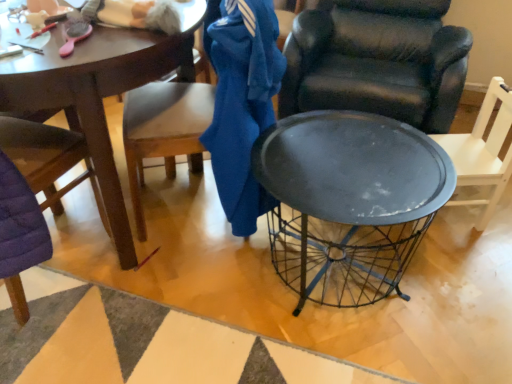
Question: Should I look upward or downward to see purple quilted chair at left, the 1th chair when ordered from left to right?

Choices:
 (A) down
 (B) up

Answer: (B)

Question: Can you confirm if matte black chair at right, positioned as the fourth chair in left-to-right order, is taller than matte black chair at center, the 2th chair when ordered from right to left?

Choices:
 (A) no
 (B) yes

Answer: (A)

Question: Can matte black chair at center, the third chair from the left, be found inside matte black chair at right, which ranks as the 1th chair in right-to-left order?

Choices:
 (A) no
 (B) yes

Answer: (A)

Question: Are matte black chair at right, which ranks as the 1th chair in right-to-left order, and matte black chair at center, the 2th chair when ordered from right to left, beside each other?

Choices:
 (A) yes
 (B) no

Answer: (B)

Question: Considering the relative positions of matte black chair at right, which ranks as the 1th chair in right-to-left order, and matte black chair at center, the 2th chair when ordered from right to left, in the image provided, is matte black chair at right, which ranks as the 1th chair in right-to-left order, to the right of matte black chair at center, the 2th chair when ordered from right to left, from the viewer's perspective?

Choices:
 (A) yes
 (B) no

Answer: (A)

Question: Is matte black chair at right, positioned as the fourth chair in left-to-right order, aimed at matte black chair at center, the third chair from the left?

Choices:
 (A) no
 (B) yes

Answer: (A)

Question: Can you confirm if matte black chair at right, positioned as the fourth chair in left-to-right order, is bigger than matte black chair at center, the 2th chair when ordered from right to left?

Choices:
 (A) no
 (B) yes

Answer: (A)

Question: Does matte black chair at right, which ranks as the 1th chair in right-to-left order, have a lesser width compared to wooden chair at left, arranged as the second chair when viewed from the left?

Choices:
 (A) yes
 (B) no

Answer: (A)

Question: Is matte black chair at right, which ranks as the 1th chair in right-to-left order, directly adjacent to wooden chair at left, placed as the third chair when sorted from right to left?

Choices:
 (A) no
 (B) yes

Answer: (A)

Question: Does matte black chair at right, which ranks as the 1th chair in right-to-left order, have a smaller size compared to wooden chair at left, arranged as the second chair when viewed from the left?

Choices:
 (A) no
 (B) yes

Answer: (B)

Question: Considering the relative sizes of matte black chair at right, positioned as the fourth chair in left-to-right order, and wooden chair at left, placed as the third chair when sorted from right to left, in the image provided, is matte black chair at right, positioned as the fourth chair in left-to-right order, bigger than wooden chair at left, placed as the third chair when sorted from right to left,?

Choices:
 (A) no
 (B) yes

Answer: (A)

Question: Is matte black chair at right, positioned as the fourth chair in left-to-right order, not close to wooden chair at left, placed as the third chair when sorted from right to left?

Choices:
 (A) no
 (B) yes

Answer: (A)

Question: Does matte black chair at right, positioned as the fourth chair in left-to-right order, have a greater height compared to wooden chair at left, placed as the third chair when sorted from right to left?

Choices:
 (A) yes
 (B) no

Answer: (B)

Question: From the image's perspective, is wooden chair at left, arranged as the second chair when viewed from the left, located beneath matte black chair at right, positioned as the fourth chair in left-to-right order?

Choices:
 (A) yes
 (B) no

Answer: (B)